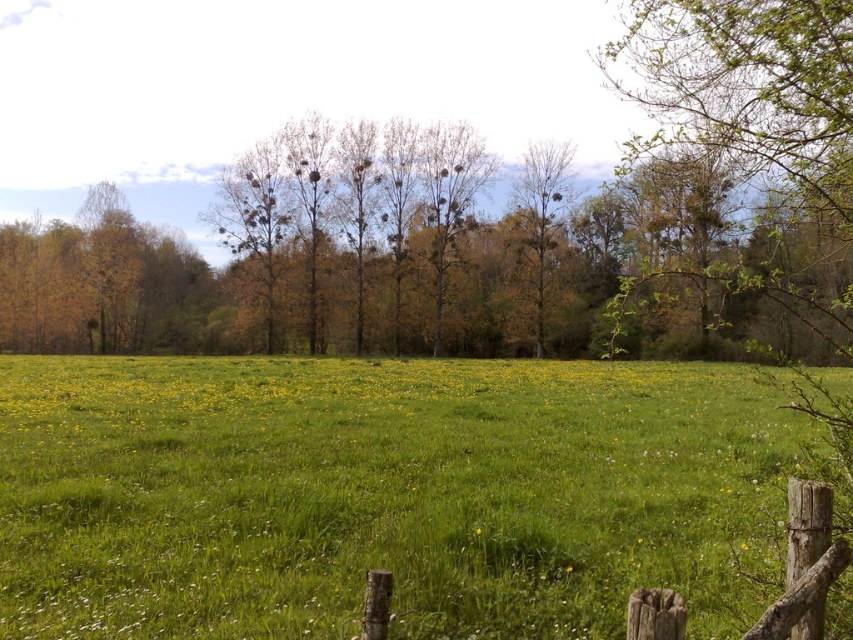
Question: Which object is closer to the camera taking this photo?

Choices:
 (A) green grassy pasture at center
 (B) wooden post at lower right

Answer: (B)

Question: Is green grassy pasture at center wider than wooden post at lower right?

Choices:
 (A) yes
 (B) no

Answer: (A)

Question: Which point is farther to the camera?

Choices:
 (A) (646, 417)
 (B) (537, 339)
 (C) (846, 563)

Answer: (B)

Question: Which of the following is the farthest from the observer?

Choices:
 (A) (294, 529)
 (B) (515, 225)

Answer: (B)

Question: Does green grassy pasture at center have a greater width compared to wooden post at lower right?

Choices:
 (A) yes
 (B) no

Answer: (A)

Question: Can you confirm if green grassy pasture at center is positioned to the left of wooden post at lower right?

Choices:
 (A) no
 (B) yes

Answer: (B)